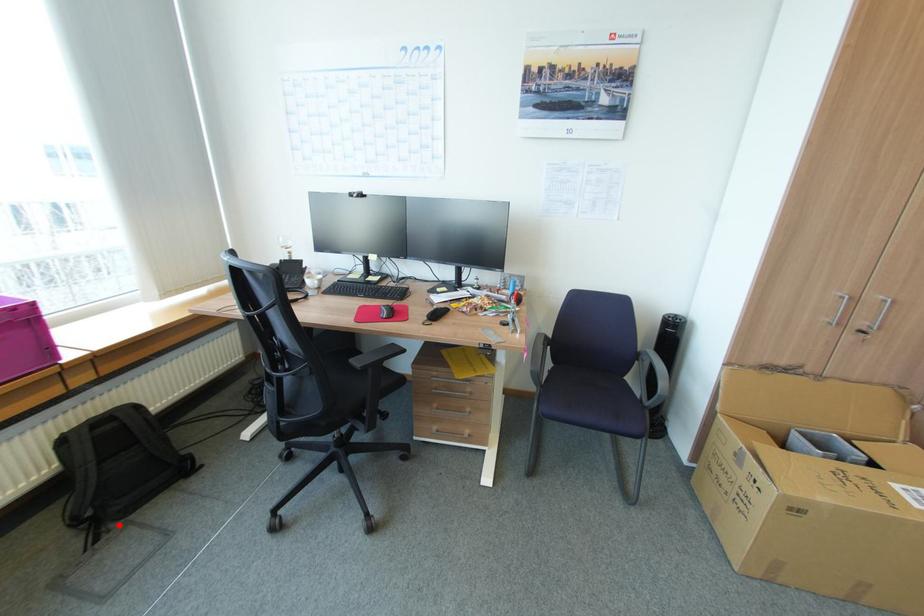
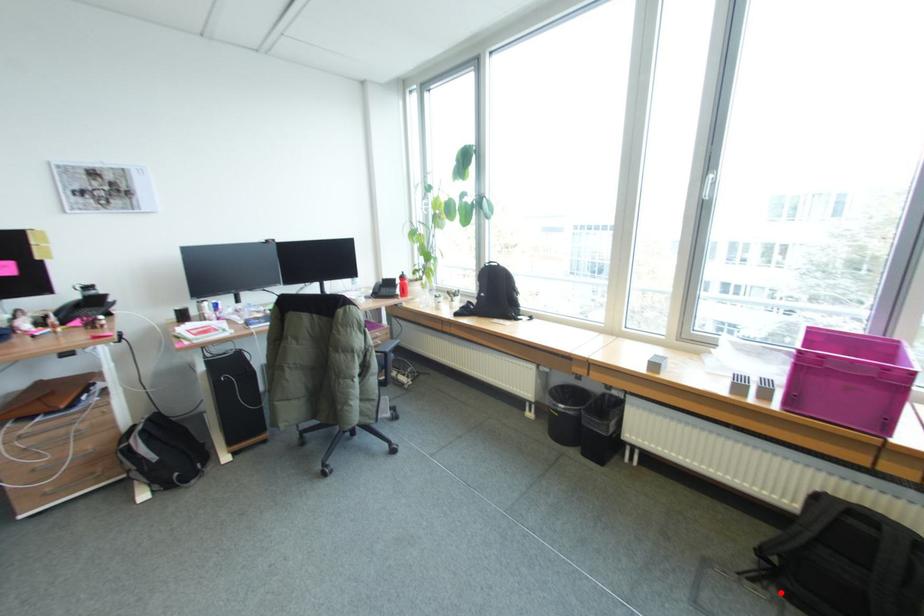
I am providing you with two images of the same scene from different viewpoints. A red point is marked on the first image and another point is marked on the second image. Do the highlighted points in image1 and image2 indicate the same real-world spot?

Yes